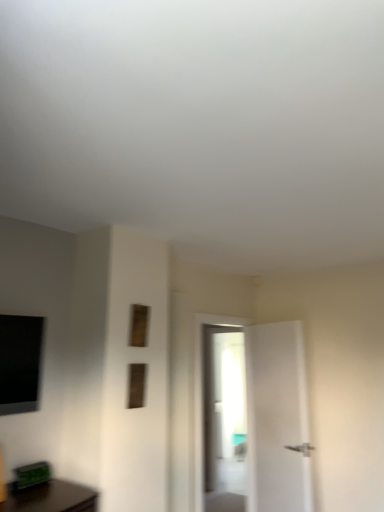
Question: Is wooden frame at upper center, which ranks as the 2th window in bottom-to-top order, wider or thinner than wooden frame at center, the 2th window in the top-to-bottom sequence?

Choices:
 (A) wide
 (B) thin

Answer: (B)

Question: Does point (137, 339) appear closer or farther from the camera than point (135, 395)?

Choices:
 (A) closer
 (B) farther

Answer: (B)

Question: Is wooden frame at upper center, which is the first window from top to bottom, situated inside wooden frame at center, which appears as the 1th window when ordered from the bottom, or outside?

Choices:
 (A) inside
 (B) outside

Answer: (B)

Question: In terms of width, does wooden frame at center, the 2th window in the top-to-bottom sequence, look wider or thinner when compared to wooden frame at upper center, which is the first window from top to bottom?

Choices:
 (A) thin
 (B) wide

Answer: (B)

Question: From the image's perspective, relative to wooden frame at upper center, which ranks as the 2th window in bottom-to-top order, is wooden frame at center, which appears as the 1th window when ordered from the bottom, above or below?

Choices:
 (A) above
 (B) below

Answer: (B)

Question: From a real-world perspective, is wooden frame at center, the 2th window in the top-to-bottom sequence, positioned above or below wooden frame at upper center, which is the first window from top to bottom?

Choices:
 (A) above
 (B) below

Answer: (B)

Question: Do you think wooden frame at center, the 2th window in the top-to-bottom sequence, is within wooden frame at upper center, which is the first window from top to bottom, or outside of it?

Choices:
 (A) inside
 (B) outside

Answer: (B)